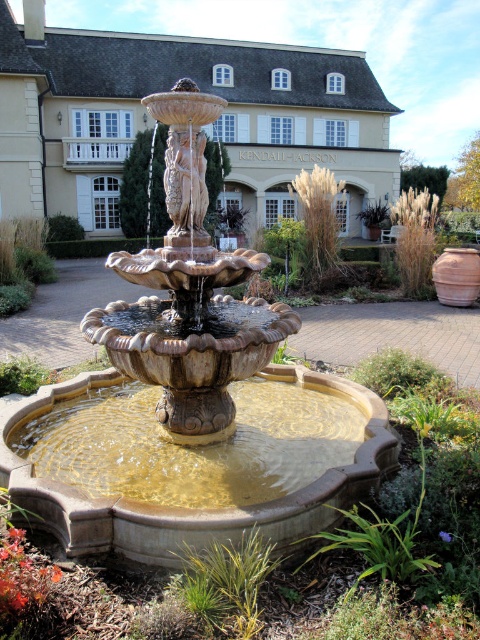
Question: Is matte stone fountain at center to the right of brown stone fountain at center from the viewer's perspective?

Choices:
 (A) no
 (B) yes

Answer: (A)

Question: Is brown stone fountain at center wider than carved stone statue at center?

Choices:
 (A) no
 (B) yes

Answer: (B)

Question: Based on their relative distances, which object is farther from the carved stone statue at center?

Choices:
 (A) matte stone fountain at center
 (B) brown stone fountain at center

Answer: (B)

Question: Among these points, which one is nearest to the camera?

Choices:
 (A) (273, 572)
 (B) (173, 228)
 (C) (283, 492)

Answer: (A)

Question: Observing the image, what is the correct spatial positioning of matte stone fountain at center in reference to carved stone statue at center?

Choices:
 (A) left
 (B) right

Answer: (B)

Question: Which of the following is the farthest from the observer?

Choices:
 (A) (240, 524)
 (B) (199, 141)

Answer: (B)